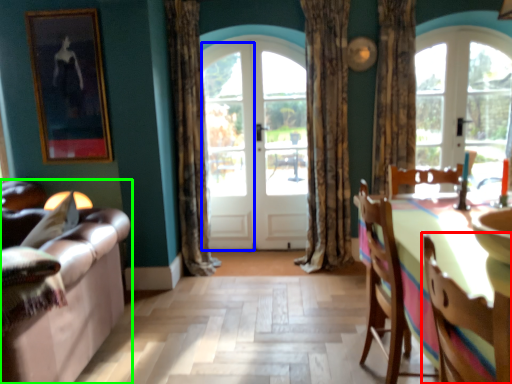
Question: Which is farther away from chair (highlighted by a red box)? screen door (highlighted by a blue box) or studio couch (highlighted by a green box)?

Choices:
 (A) screen door
 (B) studio couch

Answer: (A)